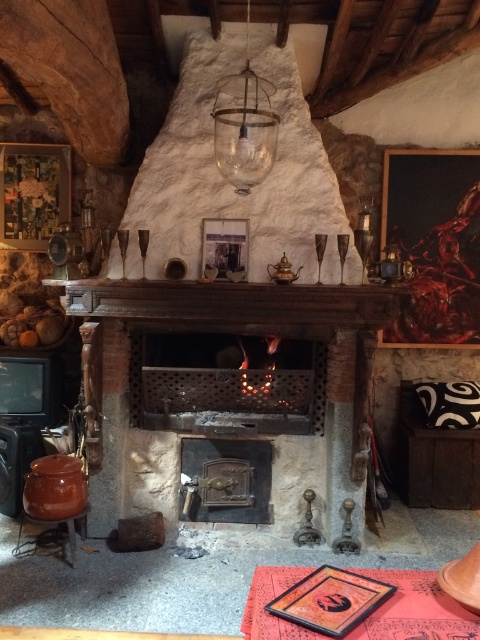
You are a painter holding a 36 inch long ladder. You need to place it between the brown wooden mantle at center and the transparent glass lamp at upper center. Can the ladder fit vertically between them without touching either object?

The distance between the brown wooden mantle at center and the transparent glass lamp at upper center is 35.87 inches. Since the ladder is 36 inches long, it is slightly longer than the available space. Therefore, the ladder cannot fit vertically between them without touching the objects.

You are an interior designer planning to place a new painting on the wall. The painting requires a hook at exactly point 0.5, 0.5. Can the brown wooden mantle at center, which is at point 0.473, 0.492, be used to hang this painting?

The brown wooden mantle at center is located at point (236, 301), which is very close to the desired point (240, 320). Since the coordinates are nearly the same, the brown wooden mantle at center can be used to hang the painting as it is positioned near the required location.

You are an interior designer planning to place a new decorative item on the mantel. Considering the sizes of the rustic wood fireplace at center and the transparent glass lamp at upper center, which object would allow for more space to add additional items next to it?

The rustic wood fireplace at center has a larger size compared to the transparent glass lamp at upper center, so placing items next to the transparent glass lamp at upper center would leave more space for additional decorations.